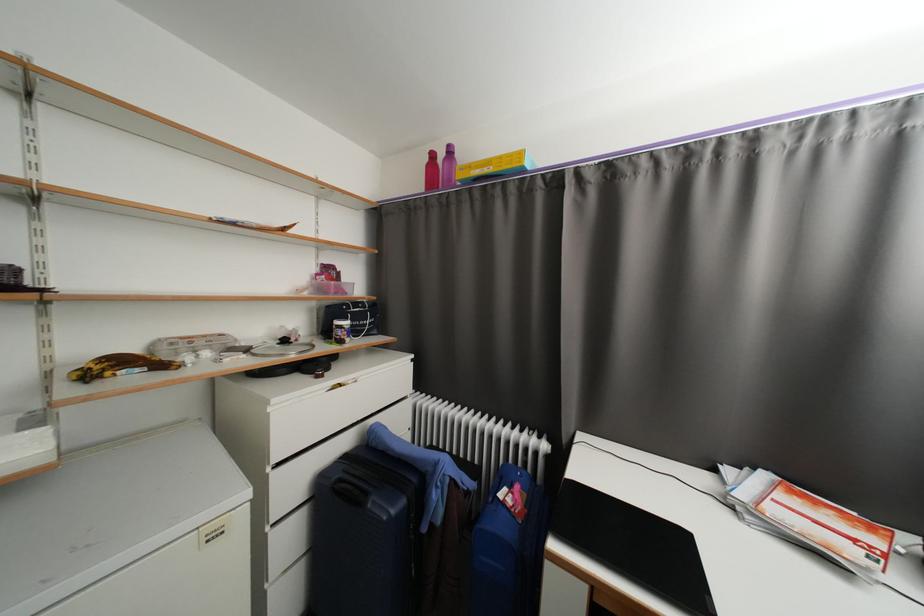
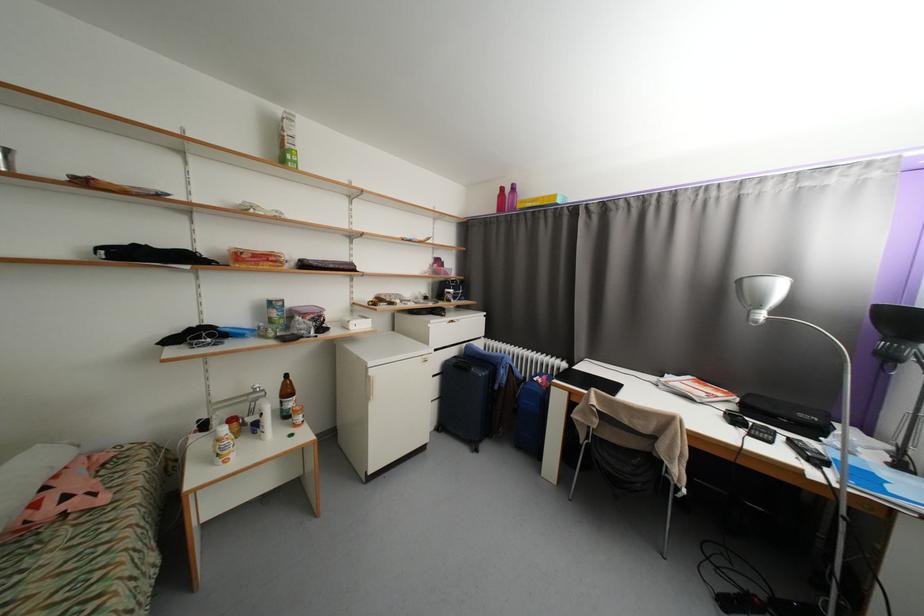
Question: I am providing you with two images of the same scene from different viewpoints. After the viewpoint changes to image2, which objects are now occluded?

Choices:
 (A) white lamp head
 (B) white plastic bottle
 (C) suitcase handle
 (D) none of these

Answer: (D)